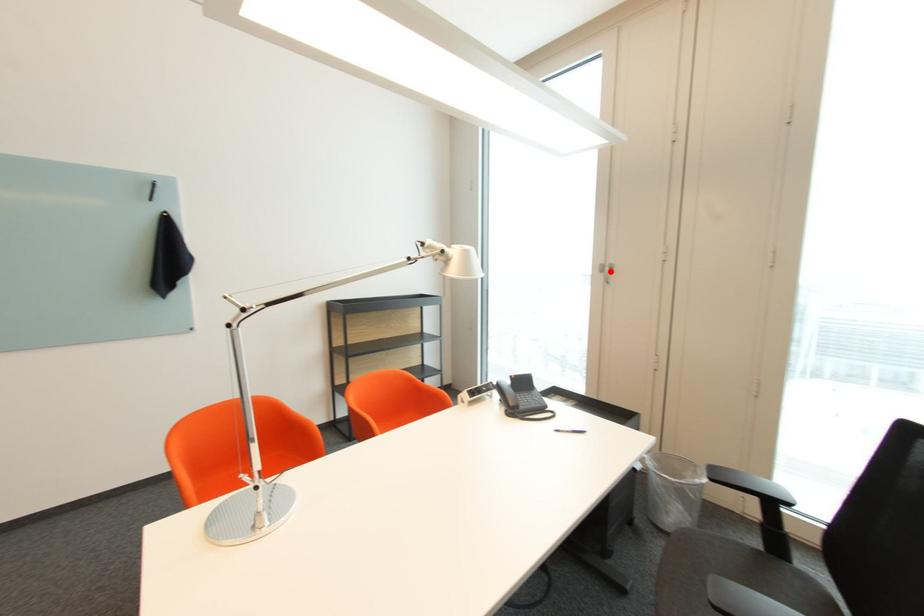
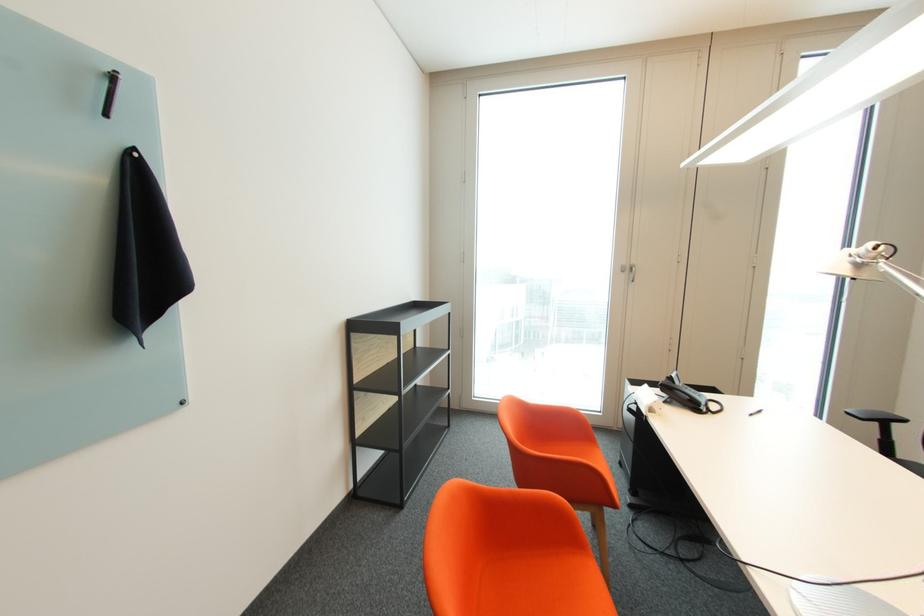
Question: I am providing you with two images of the same scene from different viewpoints. A red point is marked on the first image. At the location where the point appears in image 1, is it still visible in image 2?

Choices:
 (A) Yes
 (B) No

Answer: (A)